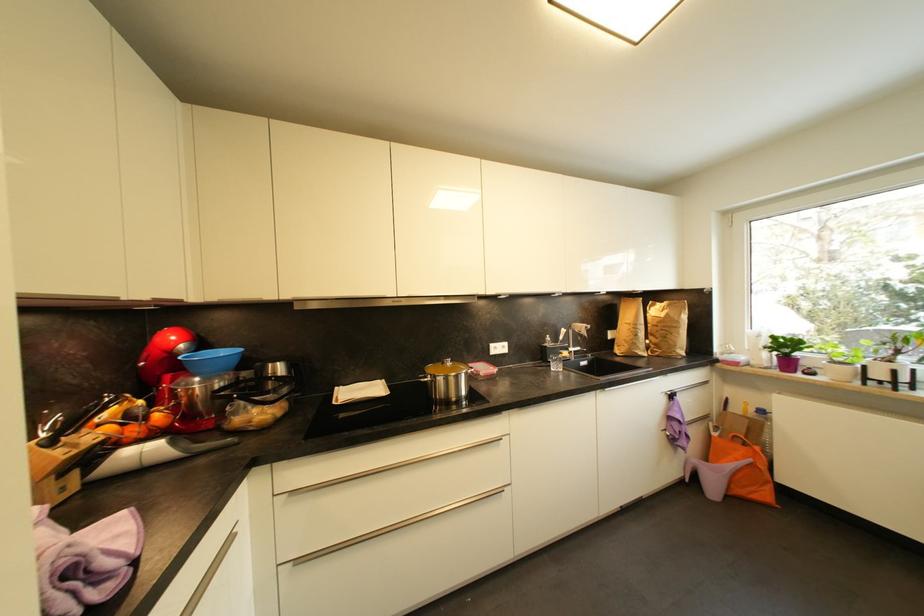
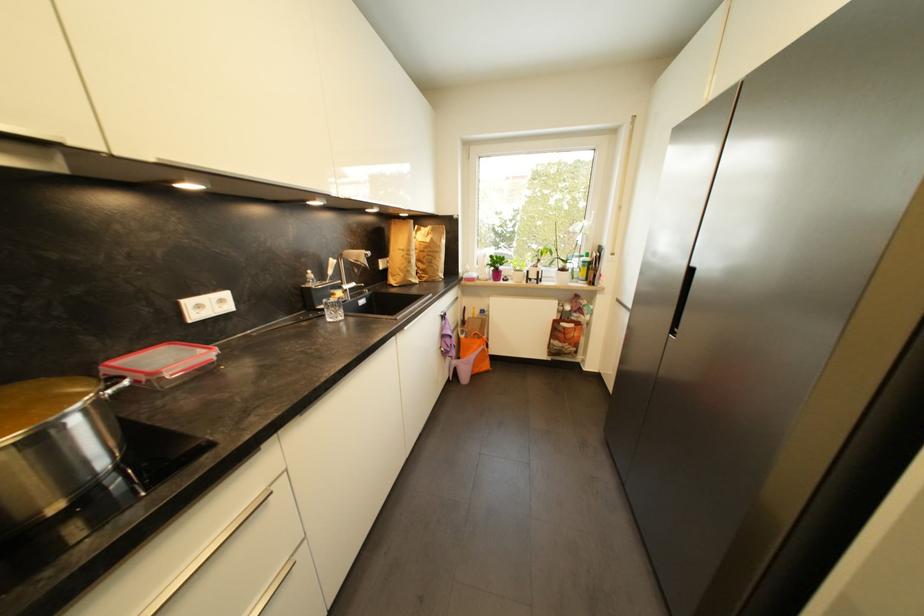
The point at (711,419) is marked in the first image. Where is the corresponding point in the second image?

(463, 328)